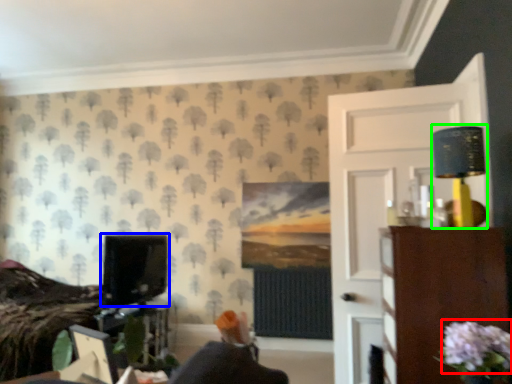
Question: Based on their relative distances, which object is farther from flower (highlighted by a red box)? Choose from computer monitor (highlighted by a blue box) and table lamp (highlighted by a green box).

Choices:
 (A) computer monitor
 (B) table lamp

Answer: (A)